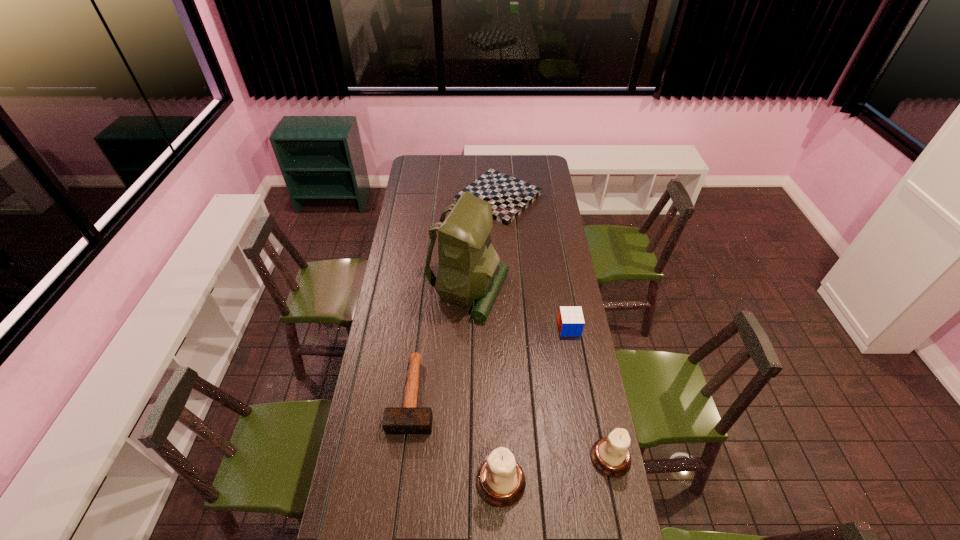
Identify the location of the left candle holder. (500, 481).

Locate an element on the screen. Image resolution: width=960 pixels, height=540 pixels. the taller candle holder is located at coordinates (500, 481).

You are a GUI agent. You are given a task and a screenshot of the screen. Output one action in this format:
    pyautogui.click(x=<x>, y=<y>)
    Task: Click on the right candle holder
    
    Given the screenshot: What is the action you would take?
    pyautogui.click(x=610, y=455)

Locate an element on the screen. the fourth shortest object is located at coordinates (610, 455).

Locate an element on the screen. The image size is (960, 540). the shortest object is located at coordinates (509, 197).

This screenshot has width=960, height=540. What are the coordinates of `checkerboard` in the screenshot? It's located at (509, 197).

This screenshot has height=540, width=960. What are the coordinates of `the tallest object` in the screenshot? It's located at (469, 267).

What are the coordinates of `cube` in the screenshot? It's located at (570, 319).

Locate an element on the screen. This screenshot has height=540, width=960. the fifth tallest object is located at coordinates (409, 419).

Where is `the fourth farthest object`? This screenshot has width=960, height=540. the fourth farthest object is located at coordinates (409, 419).